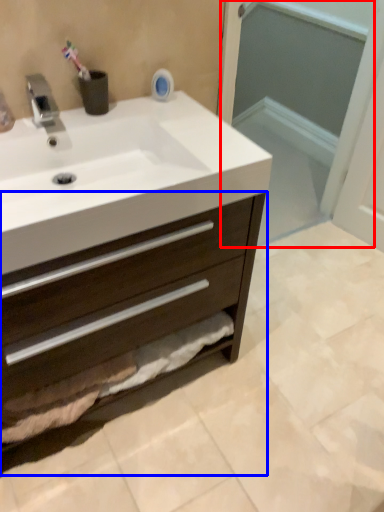
Question: Among these objects, which one is nearest to the camera, screen door (highlighted by a red box) or bathroom cabinet (highlighted by a blue box)?

Choices:
 (A) screen door
 (B) bathroom cabinet

Answer: (B)